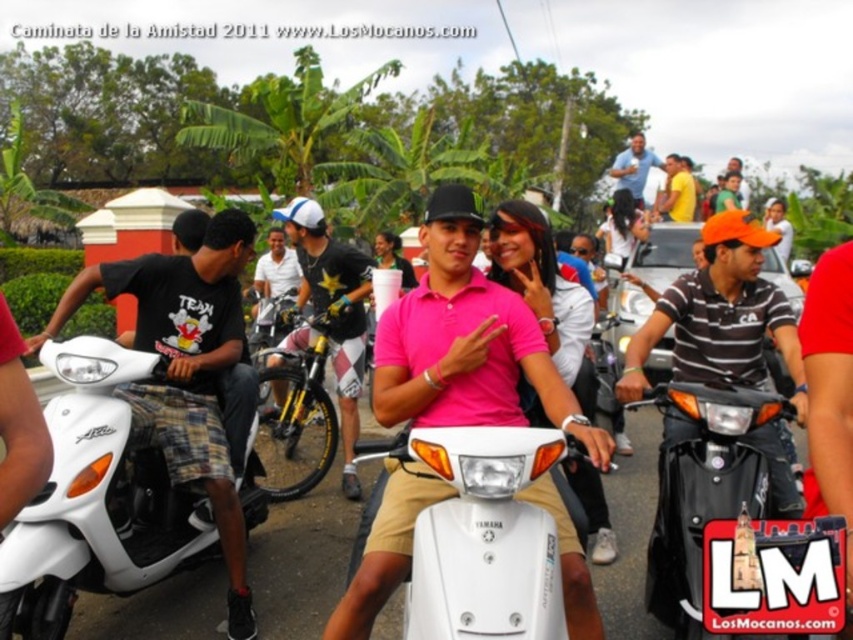
Question: Is striped cotton shirt at center positioned at the back of yellow shirt at upper right?

Choices:
 (A) yes
 (B) no

Answer: (B)

Question: Based on their relative distances, which object is farther from the yellow shirt at upper right?

Choices:
 (A) striped cotton shirt at center
 (B) pink matte polo shirt at center

Answer: (B)

Question: Among these points, which one is nearest to the camera?

Choices:
 (A) (393, 563)
 (B) (703, 284)

Answer: (A)

Question: Which point is farther from the camera taking this photo?

Choices:
 (A) (751, 426)
 (B) (688, 168)

Answer: (B)

Question: Is pink matte polo shirt at center to the right of white matte scooter at left from the viewer's perspective?

Choices:
 (A) yes
 (B) no

Answer: (A)

Question: Can you confirm if white matte scooter at center is positioned above matte blue shirt at upper center?

Choices:
 (A) no
 (B) yes

Answer: (A)